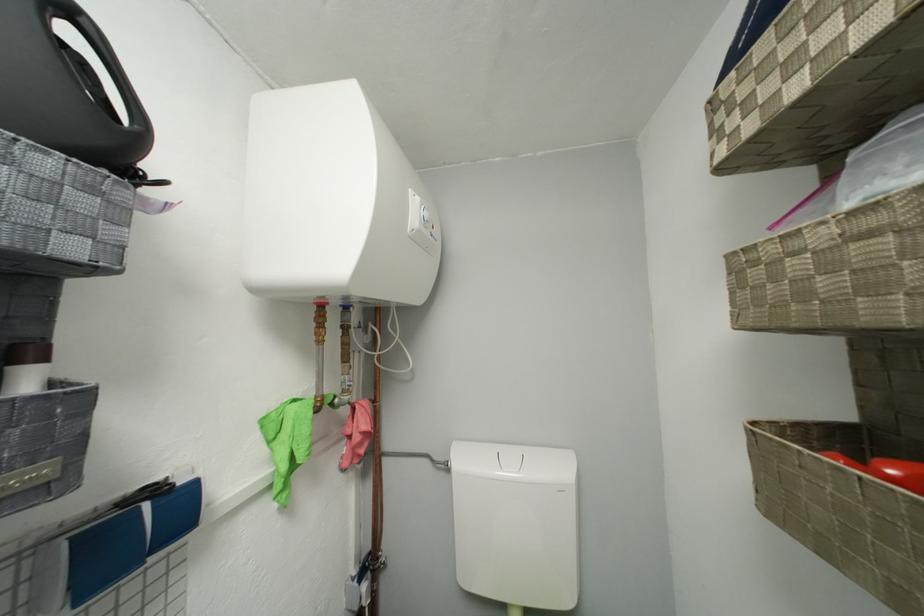
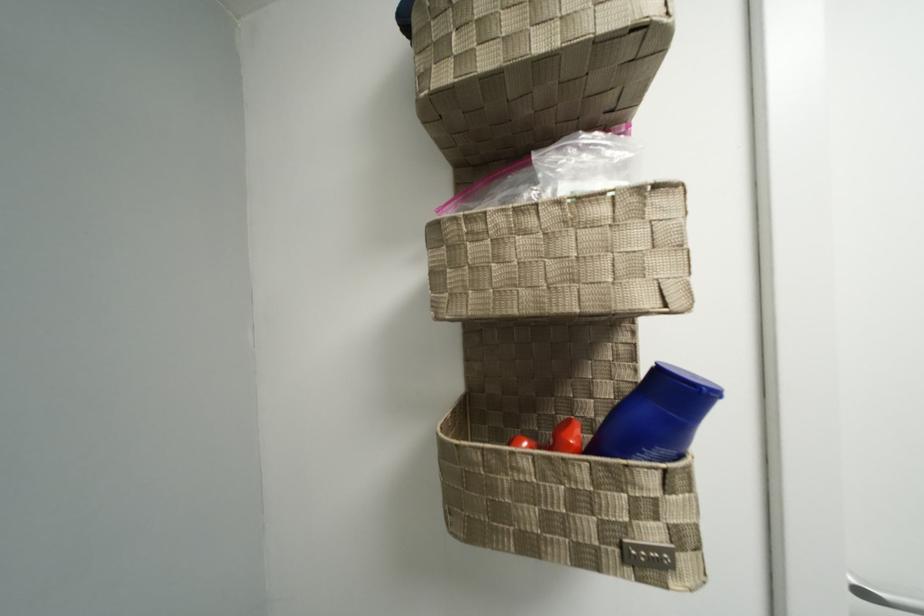
Question: The camera is either moving clockwise (left) or counter-clockwise (right) around the object. The first image is from the beginning of the video and the second image is from the end. Is the camera moving left or right when shooting the video?

Choices:
 (A) Left
 (B) Right

Answer: (A)